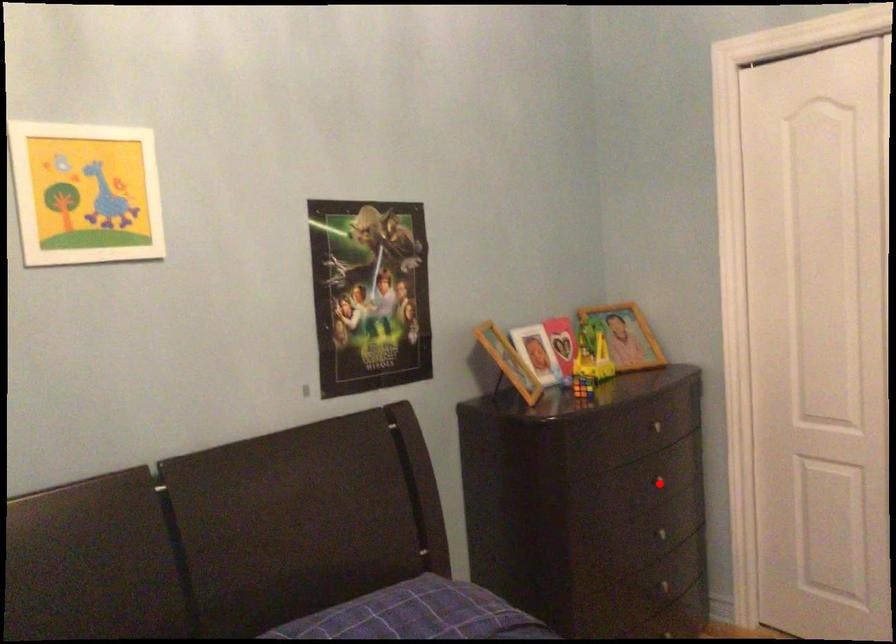
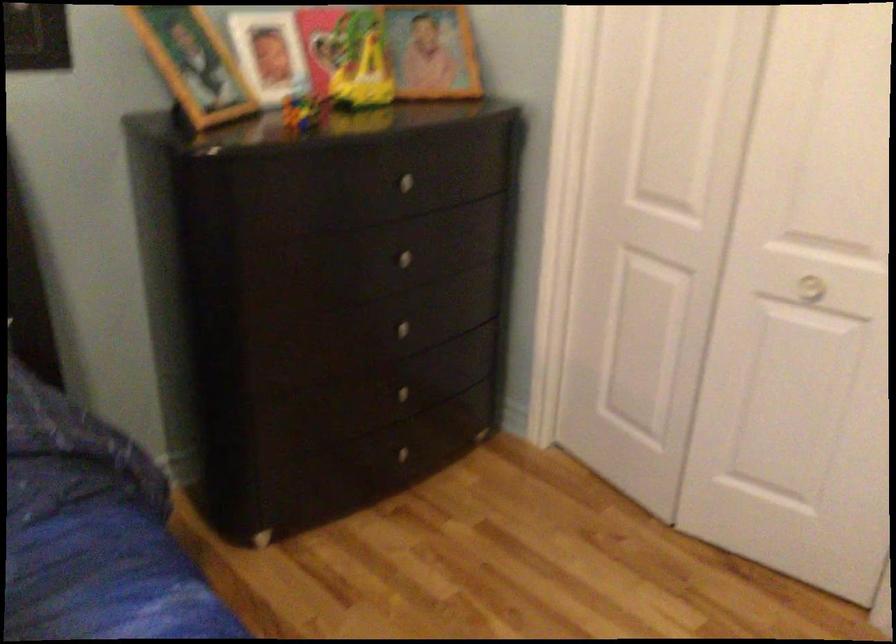
In the second image, find the point that corresponds to the highlighted location in the first image.

(399, 258)